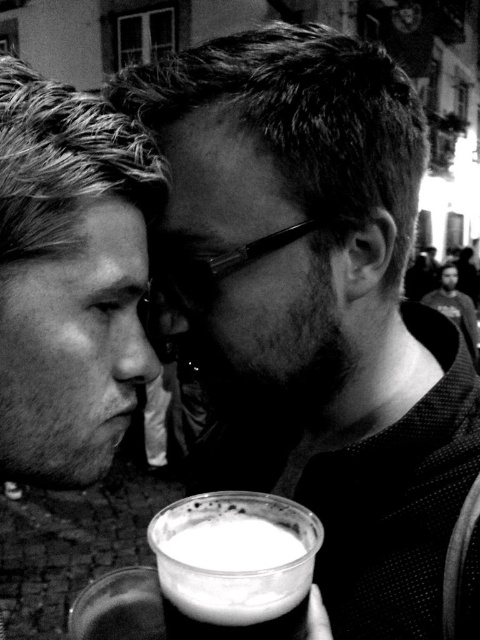
Who is more distant from viewer, (24, 268) or (305, 564)?

Positioned behind is point (24, 268).

Is smooth skin face at left taller than white frothy liquid at lower center?

Yes.

You are a GUI agent. You are given a task and a screenshot of the screen. Output one action in this format:
    pyautogui.click(x=<x>, y=<y>)
    Task: Click on the smooth skin face at left
    The image size is (480, 640).
    Given the screenshot: What is the action you would take?
    pyautogui.click(x=70, y=276)

The width and height of the screenshot is (480, 640). In order to click on smooth skin face at left in this screenshot , I will do `click(70, 276)`.